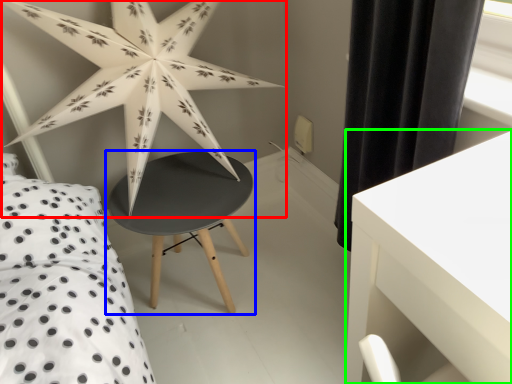
Question: Which object is positioned closest to star (highlighted by a red box)? Select from table (highlighted by a blue box) and table (highlighted by a green box).

Choices:
 (A) table
 (B) table

Answer: (A)